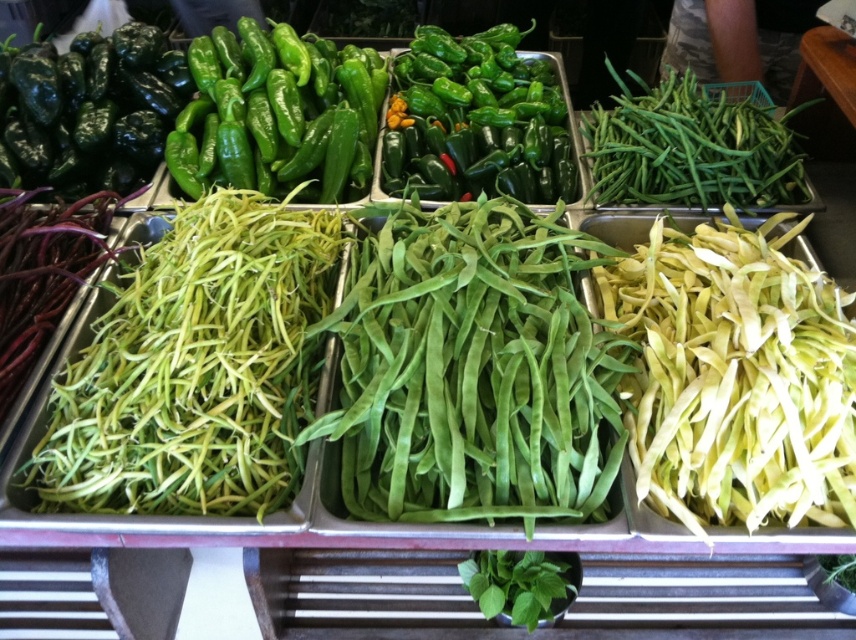
Question: Does green matte string beans at upper right have a lesser width compared to green leafy at bottom?

Choices:
 (A) yes
 (B) no

Answer: (B)

Question: Does green glossy peppers at center have a smaller size compared to glossy dark green pepper at upper left?

Choices:
 (A) no
 (B) yes

Answer: (A)

Question: Is green smooth string beans at center to the right of green glossy peppers at upper center from the viewer's perspective?

Choices:
 (A) no
 (B) yes

Answer: (B)

Question: Among these points, which one is nearest to the camera?

Choices:
 (A) (195, 340)
 (B) (123, 33)

Answer: (A)

Question: Which of the following is the closest to the observer?

Choices:
 (A) green glossy peppers at upper center
 (B) green leafy at bottom
 (C) green smooth string beans at center

Answer: (C)

Question: Which point is closer to the camera?

Choices:
 (A) green smooth string beans at center
 (B) glossy dark green pepper at upper left
 (C) yellow-green string beans at left

Answer: (A)